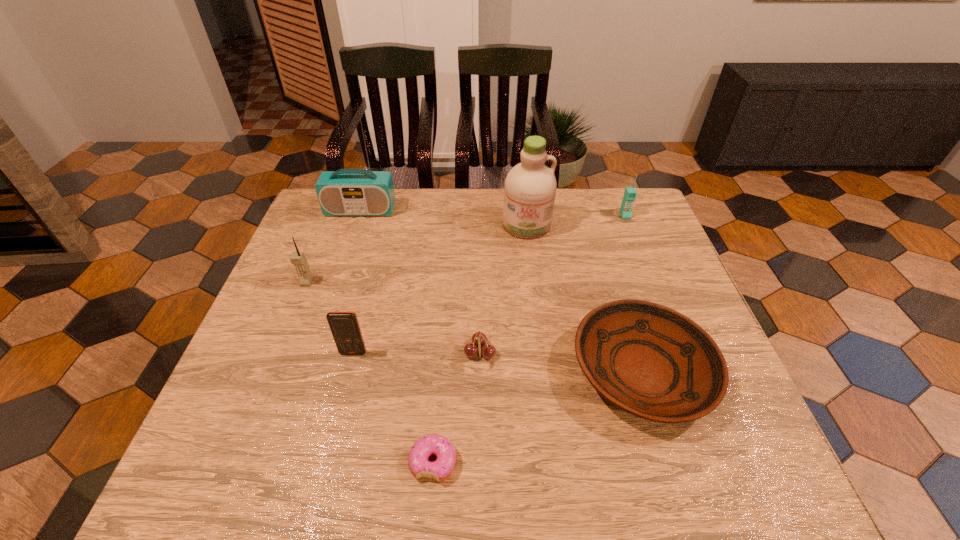
Identify the location of cellular telephone positioned at the far edge. This screenshot has width=960, height=540. (630, 193).

Locate an element on the screen. object positioned at the near edge is located at coordinates (434, 444).

The height and width of the screenshot is (540, 960). Find the location of `radio receiver that is at the left edge`. radio receiver that is at the left edge is located at coordinates (346, 192).

Locate an element on the screen. This screenshot has height=540, width=960. cellular telephone positioned at the left edge is located at coordinates (299, 260).

I want to click on cellular telephone that is at the right edge, so click(630, 193).

The image size is (960, 540). What are the coordinates of `plate located at the right edge` in the screenshot? It's located at (651, 361).

Identify the location of object that is positioned at the far left corner. The image size is (960, 540). (346, 192).

Where is `object at the far right corner`? The height and width of the screenshot is (540, 960). object at the far right corner is located at coordinates (630, 193).

Identify the location of vacant region at the far edge. coord(457,222).

This screenshot has width=960, height=540. In the image, there is a desktop. Identify the location of vacant space at the near edge. (596, 481).